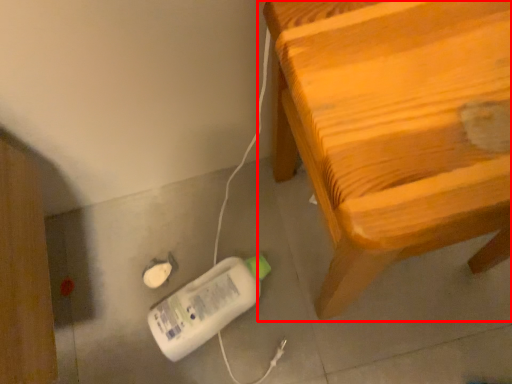
Question: From the image's perspective, considering the relative positions of furniture (annotated by the red box) and equipment in the image provided, where is furniture (annotated by the red box) located with respect to the staircase?

Choices:
 (A) above
 (B) below

Answer: (A)